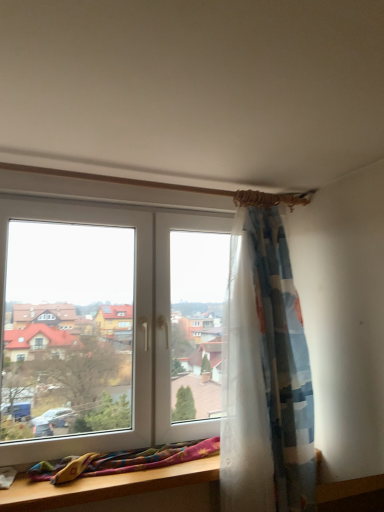
Locate an element on the screen. The height and width of the screenshot is (512, 384). multicolored woven blanket at lower left is located at coordinates (123, 461).

Describe the element at coordinates (123, 461) in the screenshot. The height and width of the screenshot is (512, 384). I see `multicolored woven blanket at lower left` at that location.

Find the location of `multicolored woven blanket at lower left`. multicolored woven blanket at lower left is located at coordinates (123, 461).